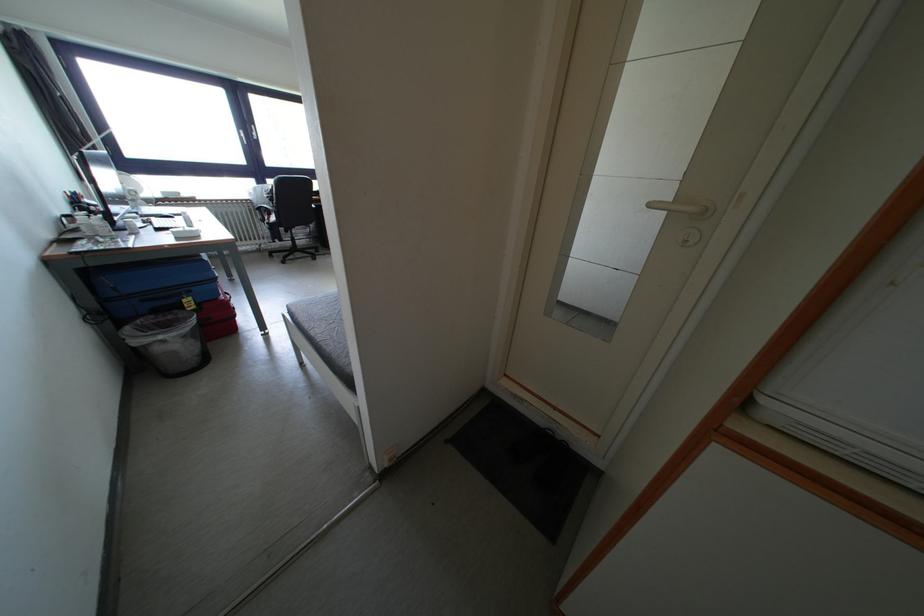
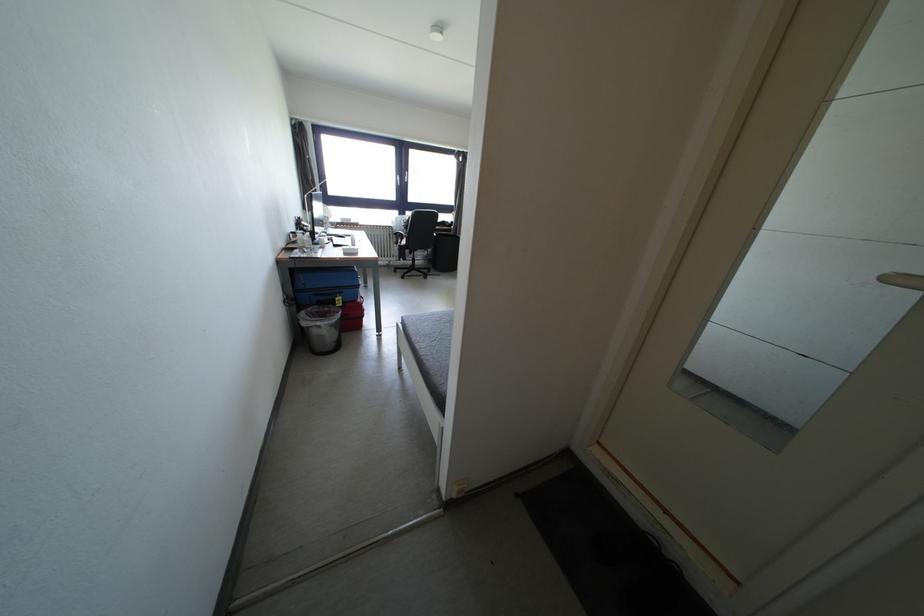
Locate, in the second image, the point that corresponds to point 190,294 in the first image.

(345, 294)